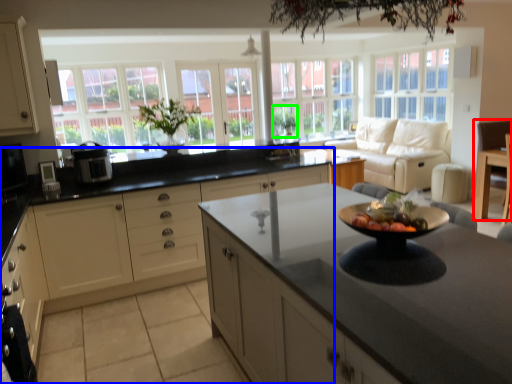
Question: Which is farther away from armchair (highlighted by a red box)? cabinetry (highlighted by a blue box) or plant (highlighted by a green box)?

Choices:
 (A) cabinetry
 (B) plant

Answer: (B)